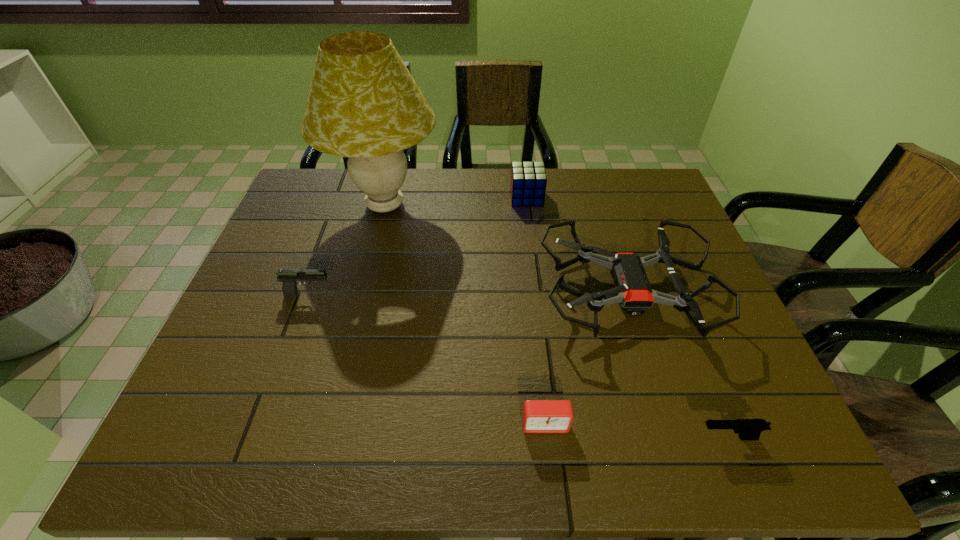
The image size is (960, 540). What are the coordinates of `vacant space located 0.070m with the camera facing forward on the drone` in the screenshot? It's located at (514, 292).

Where is `free space located 0.160m with the camera facing forward on the drone`? free space located 0.160m with the camera facing forward on the drone is located at coordinates (478, 292).

Locate an element on the screen. vacant position located with the camera facing forward on the drone is located at coordinates (392, 292).

Image resolution: width=960 pixels, height=540 pixels. I want to click on vacant space situated aim along the barrel of the left pistol, so click(x=356, y=294).

In order to click on vacant space located on the front-facing side of the shorter pistol in this screenshot , I will do `click(567, 437)`.

Identify the location of vacant space situated on the front-facing side of the shorter pistol. (650, 437).

You are a GUI agent. You are given a task and a screenshot of the screen. Output one action in this format:
    pyautogui.click(x=<x>, y=<y>)
    Task: Click on the vacant point located on the front-facing side of the shorter pistol
    
    Given the screenshot: What is the action you would take?
    pyautogui.click(x=541, y=437)

This screenshot has width=960, height=540. In order to click on lampshade present at the far edge in this screenshot , I will do `click(363, 103)`.

Locate an element on the screen. cube situated at the far edge is located at coordinates coord(528,182).

Where is `alarm clock positioned at the near edge`? This screenshot has width=960, height=540. alarm clock positioned at the near edge is located at coordinates (539, 416).